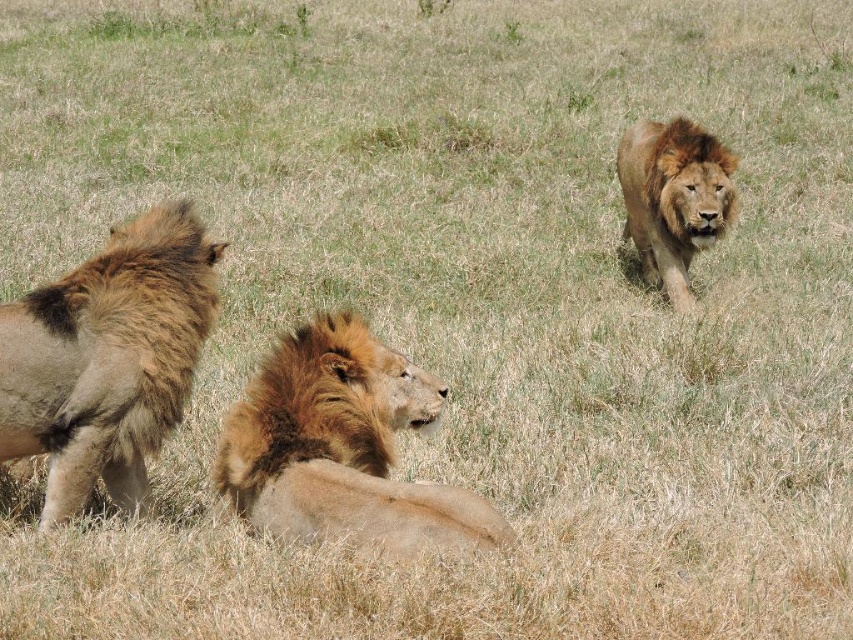
Looking at this image, does fuzzy brown lion at left have a lesser height compared to golden brown fur lion at center?

No.

At what (x,y) coordinates should I click in order to perform the action: click on fuzzy brown lion at left. Please return your answer as a coordinate pair (x, y). This screenshot has width=853, height=640. Looking at the image, I should click on (108, 358).

Where is `fuzzy brown lion at left`? The width and height of the screenshot is (853, 640). fuzzy brown lion at left is located at coordinates (108, 358).

Which is in front, point (387, 509) or point (717, 224)?

Point (387, 509) is in front.

Does golden brown fur lion at center have a lesser width compared to golden brown mane at upper right?

Incorrect, golden brown fur lion at center's width is not less than golden brown mane at upper right's.

At what (x,y) coordinates should I click in order to perform the action: click on golden brown fur lion at center. Please return your answer as a coordinate pair (x, y). The width and height of the screenshot is (853, 640). Looking at the image, I should click on (341, 445).

Is fuzzy brown lion at left shorter than golden brown mane at upper right?

Yes.

Which is behind, point (9, 422) or point (663, 272)?

The point (663, 272) is behind.

The image size is (853, 640). I want to click on fuzzy brown lion at left, so click(108, 358).